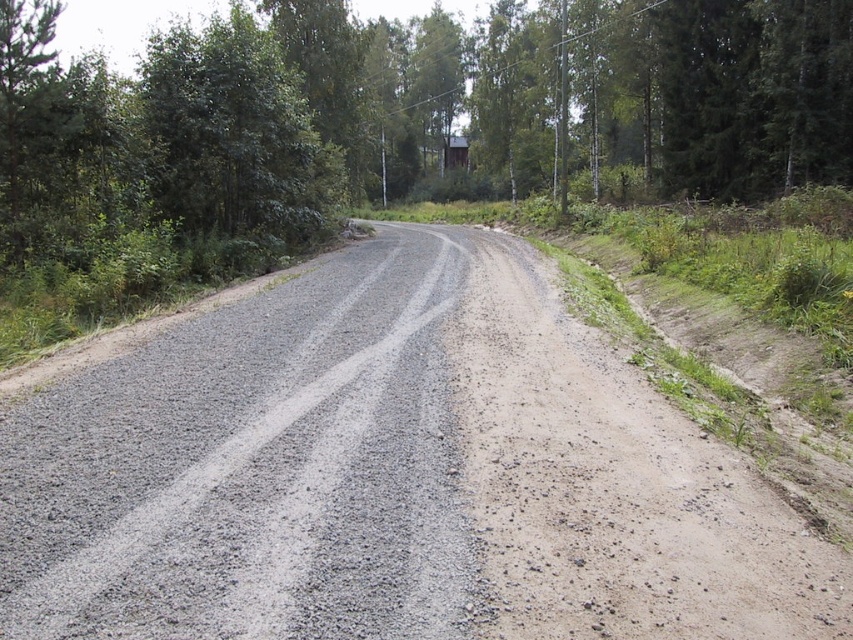
You are a hiker trying to navigate the gray gravel road at center. You notice the green leafy tree at upper left in the distance. Which object takes up more space in the image?

The green leafy tree at upper left takes up more space in the image than the gray gravel road at center, as the road occupies less space according to the description.